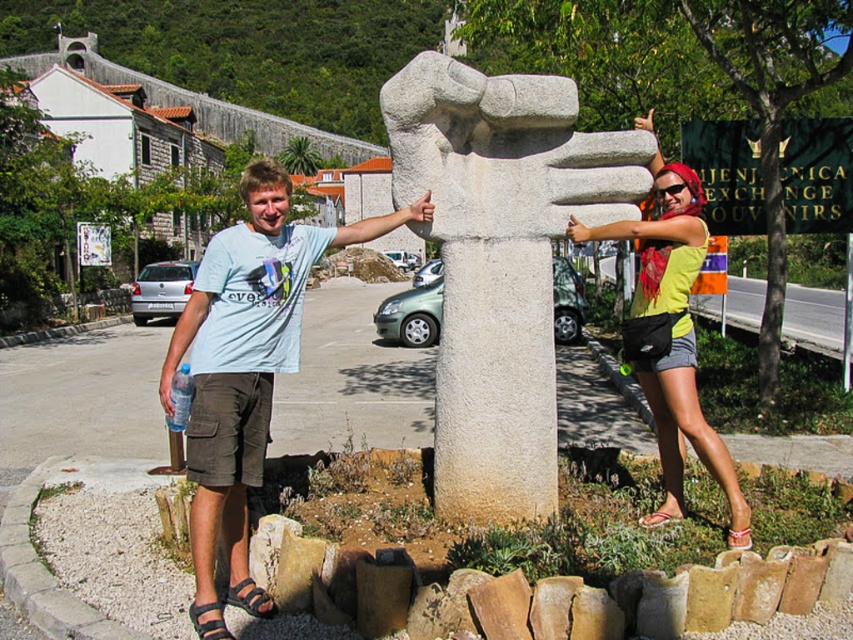
Can you confirm if matte stone statue at center is positioned to the right of white stone sculpture at center?

Yes, matte stone statue at center is to the right of white stone sculpture at center.

The width and height of the screenshot is (853, 640). Describe the element at coordinates (496, 264) in the screenshot. I see `matte stone statue at center` at that location.

Find the location of a particular element. This screenshot has height=640, width=853. matte stone statue at center is located at coordinates (496, 264).

Can you confirm if light blue t-shirt at center is positioned to the left of yellow-green fabric bag at upper right?

Correct, you'll find light blue t-shirt at center to the left of yellow-green fabric bag at upper right.

Does light blue t-shirt at center come in front of yellow-green fabric bag at upper right?

Yes, it is in front of yellow-green fabric bag at upper right.

Locate an element on the screen. The width and height of the screenshot is (853, 640). light blue t-shirt at center is located at coordinates (245, 369).

The width and height of the screenshot is (853, 640). I want to click on light blue t-shirt at center, so pos(245,369).

Does white stone sculpture at center have a lesser width compared to yellow-green fabric bag at upper right?

No.

Is white stone sculpture at center shorter than yellow-green fabric bag at upper right?

Yes, white stone sculpture at center is shorter than yellow-green fabric bag at upper right.

The width and height of the screenshot is (853, 640). What are the coordinates of `white stone sculpture at center` in the screenshot? It's located at (500, 260).